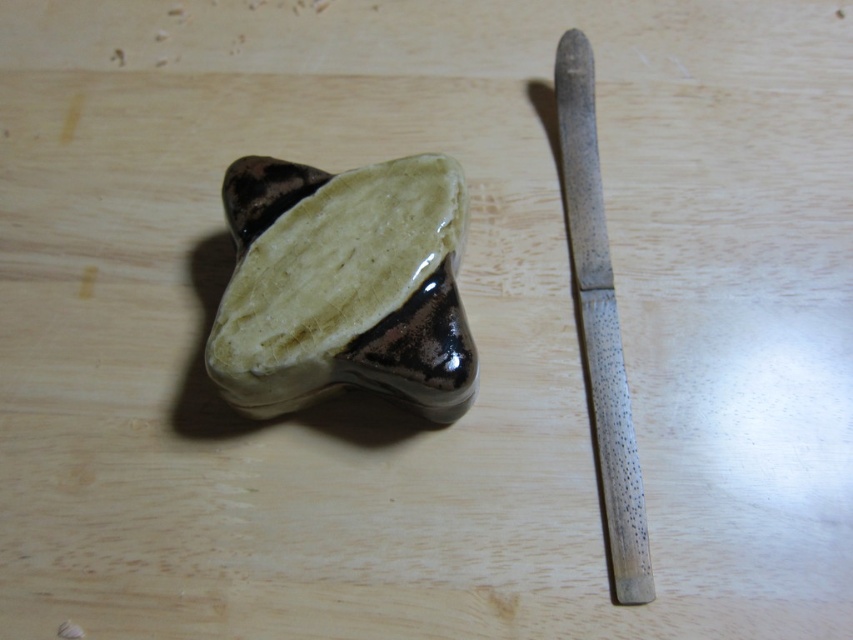
You are arranging items on a narrow shelf that can only accommodate items up to the width of the speckled wood knife at right. Can the glossy ceramic stone at center fit on this shelf?

The glossy ceramic stone at center is wider than the speckled wood knife at right, so it cannot fit on the shelf designed for the knife.

You are arranging items on a table and need to place both the glossy ceramic stone at center and the speckled wood knife at right. If you want to ensure the shorter item is placed closer to you, which object should you position nearer?

The glossy ceramic stone at center is not as tall as the speckled wood knife at right, so you should position the glossy ceramic stone at center closer to you since it is shorter.

You are arranging items on a table and want to place the glossy ceramic stone at center and the speckled wood knife at right. Based on their positions in the image, which item is higher up?

The glossy ceramic stone at center is above the speckled wood knife at right, so it is higher up.